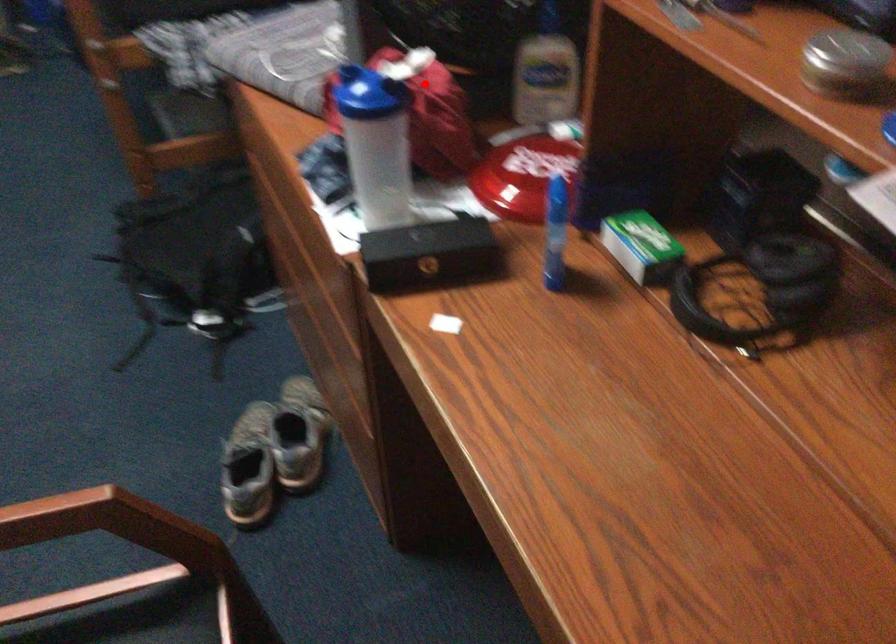
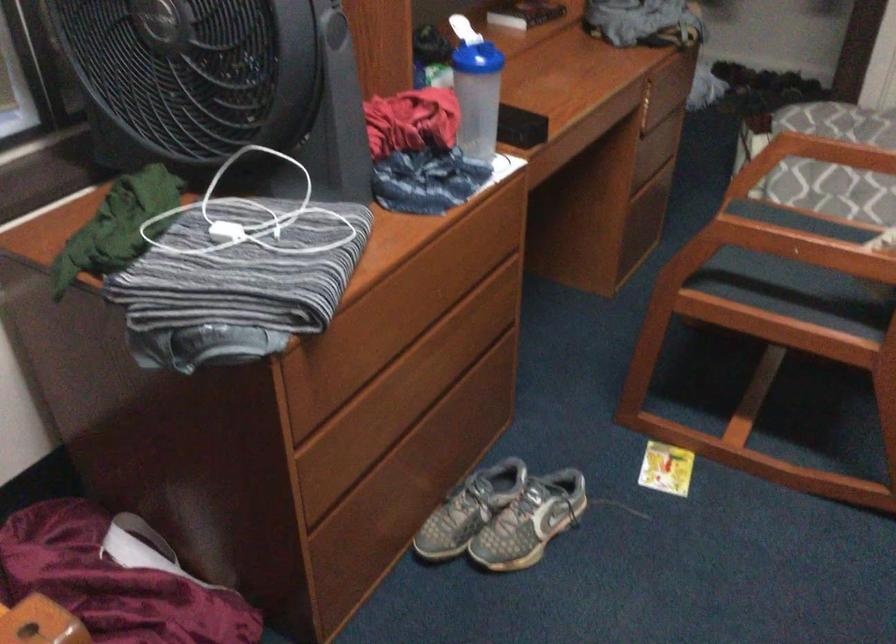
Question: A red point is marked in image1. In image2, is the corresponding 3D point closer to the camera or farther? Reply with the corresponding letter.

Choices:
 (A) The corresponding 3D point is closer.
 (B) The corresponding 3D point is farther.

Answer: (B)